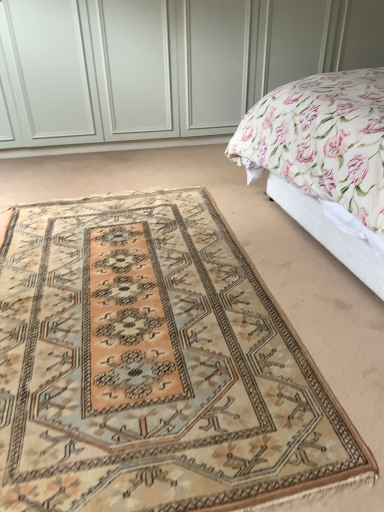
Question: Is beige wool rug at center taller than floral fabric bed at upper right?

Choices:
 (A) no
 (B) yes

Answer: (A)

Question: Does beige wool rug at center turn towards floral fabric bed at upper right?

Choices:
 (A) no
 (B) yes

Answer: (A)

Question: Considering the relative positions of beige wool rug at center and floral fabric bed at upper right in the image provided, is beige wool rug at center to the right of floral fabric bed at upper right from the viewer's perspective?

Choices:
 (A) yes
 (B) no

Answer: (B)

Question: Considering the relative sizes of beige wool rug at center and floral fabric bed at upper right in the image provided, is beige wool rug at center smaller than floral fabric bed at upper right?

Choices:
 (A) yes
 (B) no

Answer: (A)

Question: Can we say beige wool rug at center lies outside floral fabric bed at upper right?

Choices:
 (A) no
 (B) yes

Answer: (B)

Question: Is beige wool rug at center beside floral fabric bed at upper right?

Choices:
 (A) no
 (B) yes

Answer: (A)

Question: Considering the relative sizes of floral fabric bed at upper right and beige wool rug at center in the image provided, is floral fabric bed at upper right bigger than beige wool rug at center?

Choices:
 (A) no
 (B) yes

Answer: (B)

Question: Considering the relative sizes of floral fabric bed at upper right and beige wool rug at center in the image provided, is floral fabric bed at upper right taller than beige wool rug at center?

Choices:
 (A) yes
 (B) no

Answer: (A)

Question: Considering the relative sizes of floral fabric bed at upper right and beige wool rug at center in the image provided, is floral fabric bed at upper right shorter than beige wool rug at center?

Choices:
 (A) no
 (B) yes

Answer: (A)

Question: Could you tell me if floral fabric bed at upper right is turned towards beige wool rug at center?

Choices:
 (A) no
 (B) yes

Answer: (B)

Question: From the image's perspective, is floral fabric bed at upper right below beige wool rug at center?

Choices:
 (A) no
 (B) yes

Answer: (A)

Question: Is the surface of floral fabric bed at upper right in direct contact with beige wool rug at center?

Choices:
 (A) yes
 (B) no

Answer: (B)

Question: Is beige wool rug at center to the left or to the right of floral fabric bed at upper right in the image?

Choices:
 (A) left
 (B) right

Answer: (A)